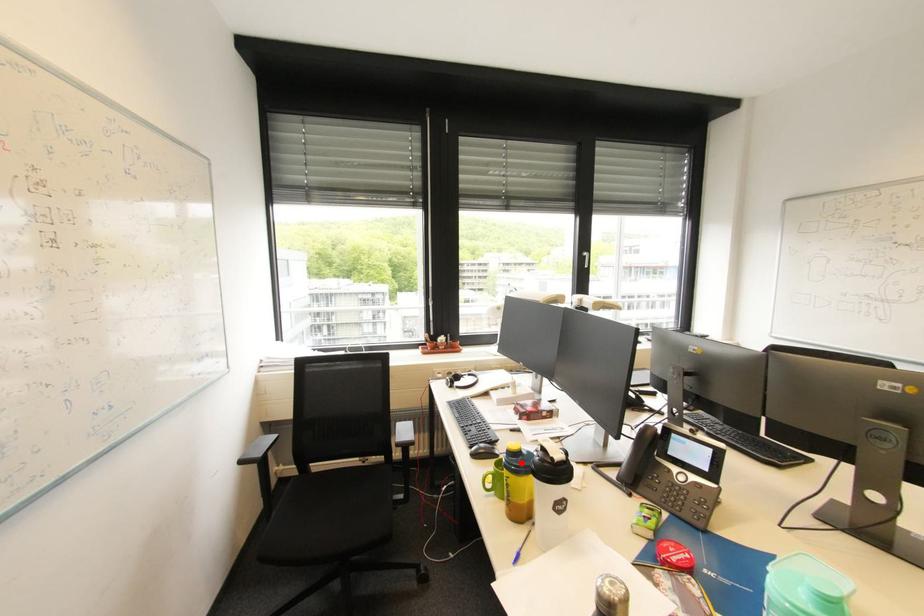
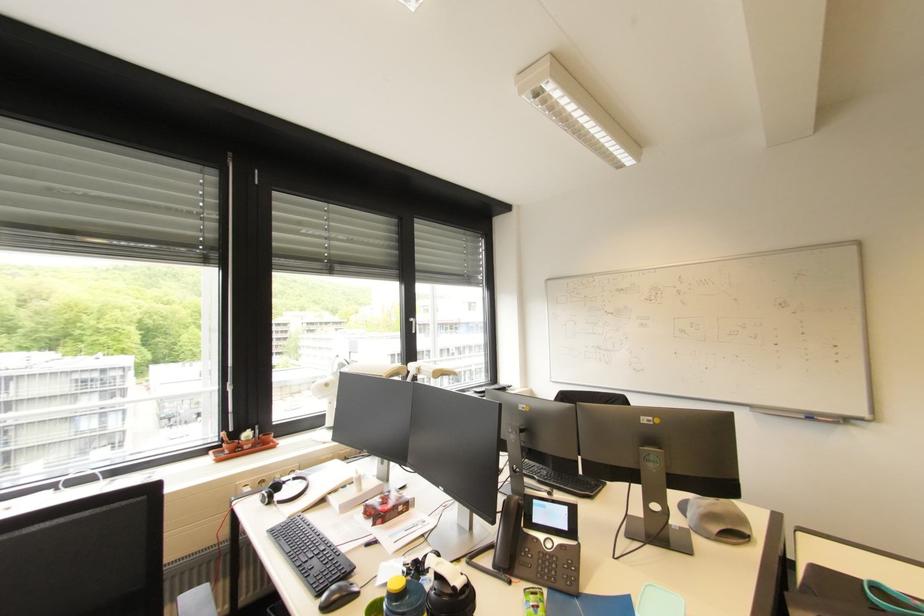
Find the pixel in the second image that matches the highlighted location in the first image.

(408, 608)